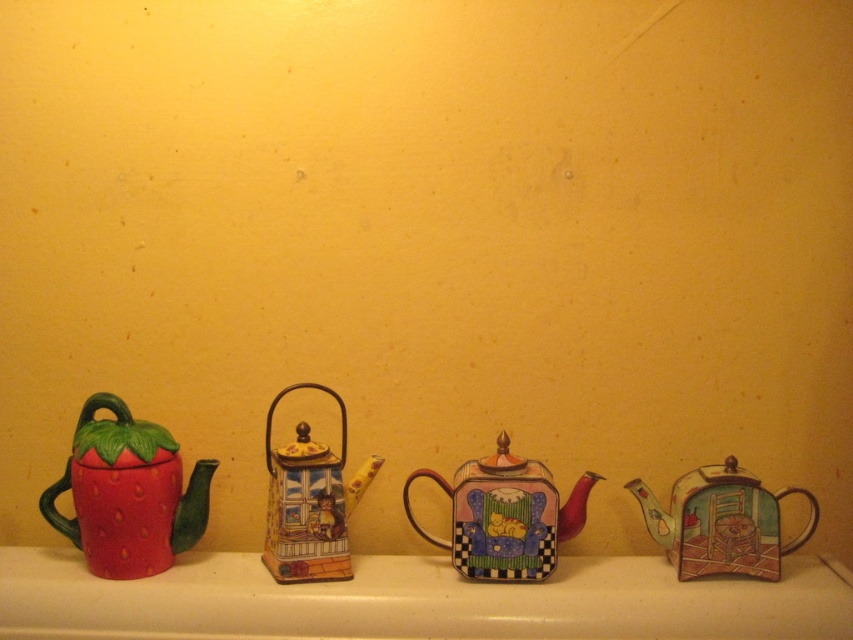
Is white glossy window sill at center below matte ceramic teapot at center?

Indeed, white glossy window sill at center is positioned under matte ceramic teapot at center.

Does point (202, 588) come behind point (292, 524)?

No, (202, 588) is in front of (292, 524).

At what (x,y) coordinates should I click in order to perform the action: click on white glossy window sill at center. Please return your answer as a coordinate pair (x, y). Image resolution: width=853 pixels, height=640 pixels. Looking at the image, I should click on (416, 600).

Is metallic silver teapot at right behind matte ceramic teapot at center?

Yes.

Does metallic silver teapot at right have a greater height compared to matte ceramic teapot at center?

In fact, metallic silver teapot at right may be shorter than matte ceramic teapot at center.

Is point (712, 493) farther from viewer compared to point (299, 534)?

That is False.

Find the location of a particular element. The image size is (853, 640). metallic silver teapot at right is located at coordinates (721, 522).

Does point (93, 516) come farther from viewer compared to point (786, 548)?

No, it is not.

You are a GUI agent. You are given a task and a screenshot of the screen. Output one action in this format:
    pyautogui.click(x=<x>, y=<y>)
    Task: Click on the matte ceramic strawberry-shaped teapot at left
    This screenshot has height=640, width=853.
    Given the screenshot: What is the action you would take?
    pyautogui.click(x=128, y=493)

Where is `matte ceramic strawberry-shaped teapot at left`? matte ceramic strawberry-shaped teapot at left is located at coordinates (128, 493).

I want to click on matte ceramic strawberry-shaped teapot at left, so point(128,493).